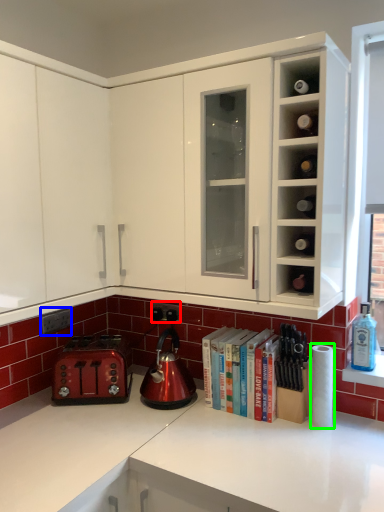
Question: Which object is positioned farthest from electric outlet (highlighted by a red box)? Select from electric outlet (highlighted by a blue box) and paper towel (highlighted by a green box).

Choices:
 (A) electric outlet
 (B) paper towel

Answer: (B)